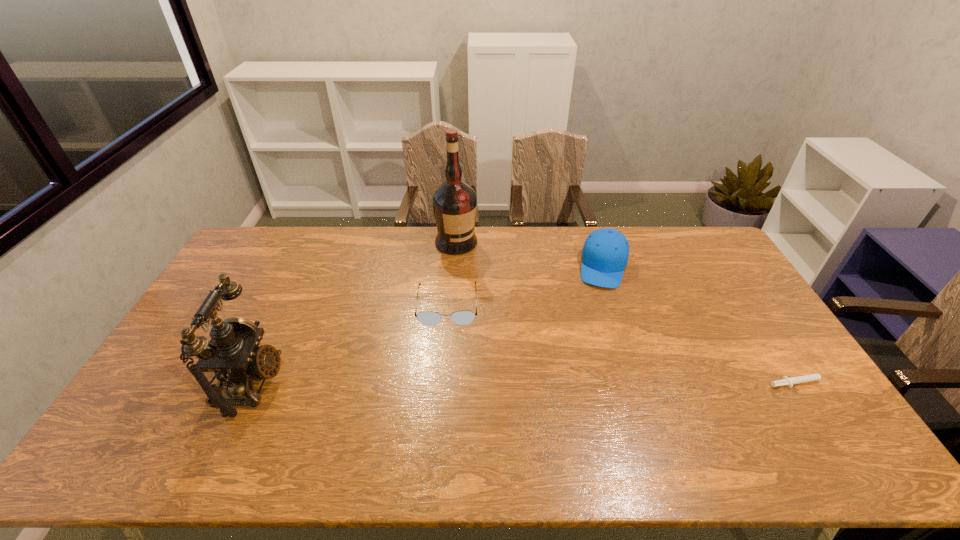
The image size is (960, 540). Identify the location of free point between the tallest object and the third tallest object. (530, 254).

You are a GUI agent. You are given a task and a screenshot of the screen. Output one action in this format:
    pyautogui.click(x=<x>, y=<y>)
    Task: Click on the empty space that is in between the telephone and the rightmost object
    The height and width of the screenshot is (540, 960).
    Given the screenshot: What is the action you would take?
    pyautogui.click(x=527, y=383)

You are a GUI agent. You are given a task and a screenshot of the screen. Output one action in this format:
    pyautogui.click(x=<x>, y=<y>)
    Task: Click on the free space between the syringe and the cap
    The image size is (960, 540).
    Given the screenshot: What is the action you would take?
    pyautogui.click(x=704, y=325)

The image size is (960, 540). I want to click on free spot between the spectacles and the shortest object, so click(x=625, y=344).

Image resolution: width=960 pixels, height=540 pixels. I want to click on blank region between the spectacles and the second tallest object, so click(349, 344).

At what (x,y) coordinates should I click in order to perform the action: click on empty space between the spectacles and the second object from right to left. Please return your answer as a coordinate pair (x, y). This screenshot has height=540, width=960. Looking at the image, I should click on (525, 286).

Locate an element on the screen. vacant space in between the second object from right to left and the spectacles is located at coordinates (525, 286).

You are a GUI agent. You are given a task and a screenshot of the screen. Output one action in this format:
    pyautogui.click(x=<x>, y=<y>)
    Task: Click on the second closest object relative to the second tallest object
    
    Given the screenshot: What is the action you would take?
    pyautogui.click(x=454, y=202)

The image size is (960, 540). I want to click on object that is the third nearest to the fourth tallest object, so click(605, 253).

Identify the location of free region that satisfies the following two spatial constraints: 1. on the front side of the syringe; 2. on the right side of the liquor. click(447, 383).